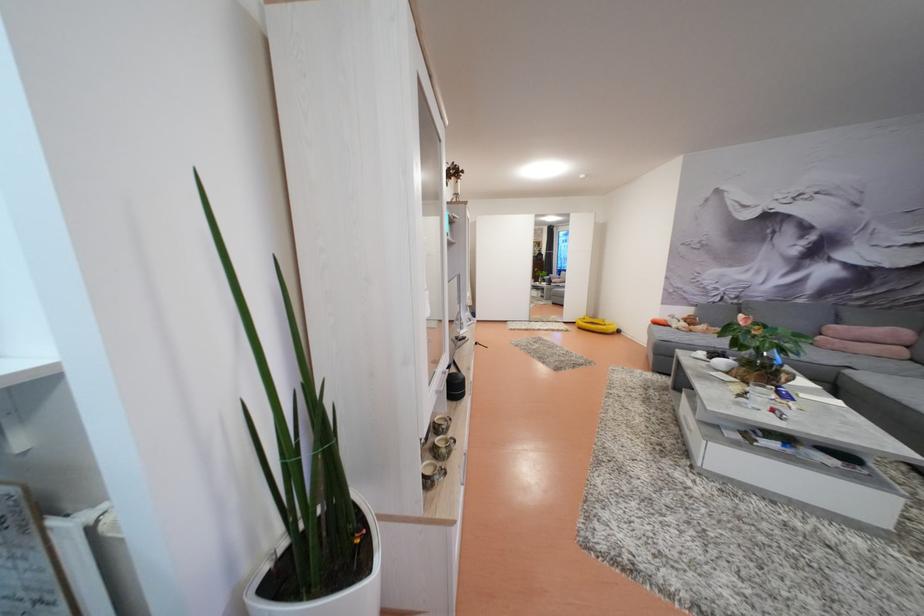
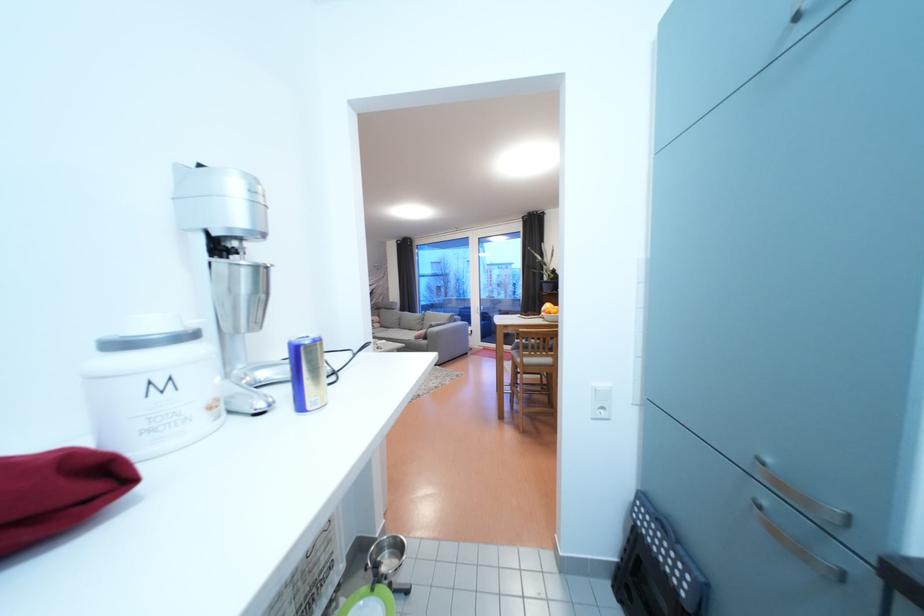
Question: I am providing you with two images of the same scene from different viewpoints. Which of the following objects are not visible in image2?

Choices:
 (A) radiator valve knob
 (B) metal cabinet handle
 (C) black cylindrical speaker
 (D) black step stool

Answer: (C)